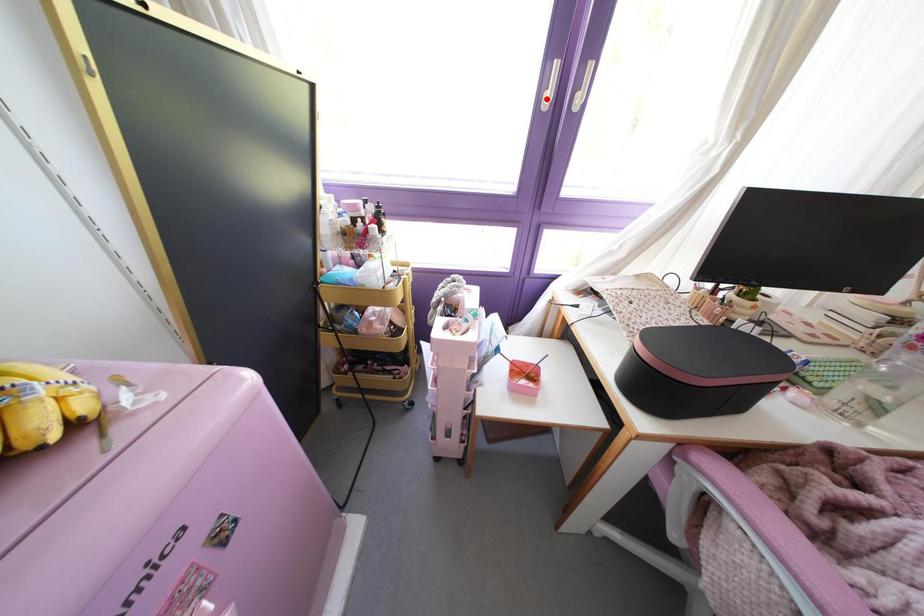
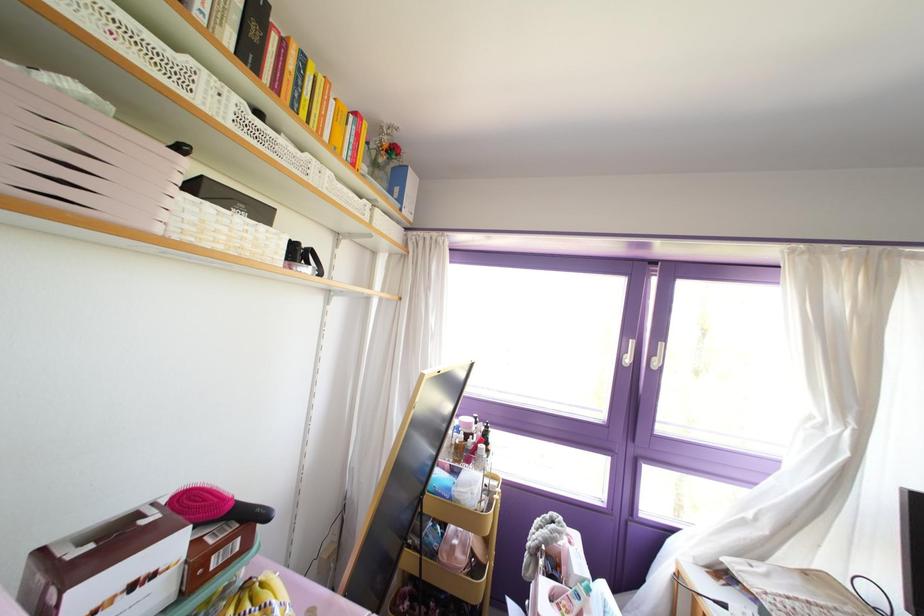
Question: I am providing you with two images of the same scene from different viewpoints. A red point is shown in image1. For the corresponding object point in image2, is it positioned nearer or farther from the camera?

Choices:
 (A) Nearer
 (B) Farther

Answer: (B)